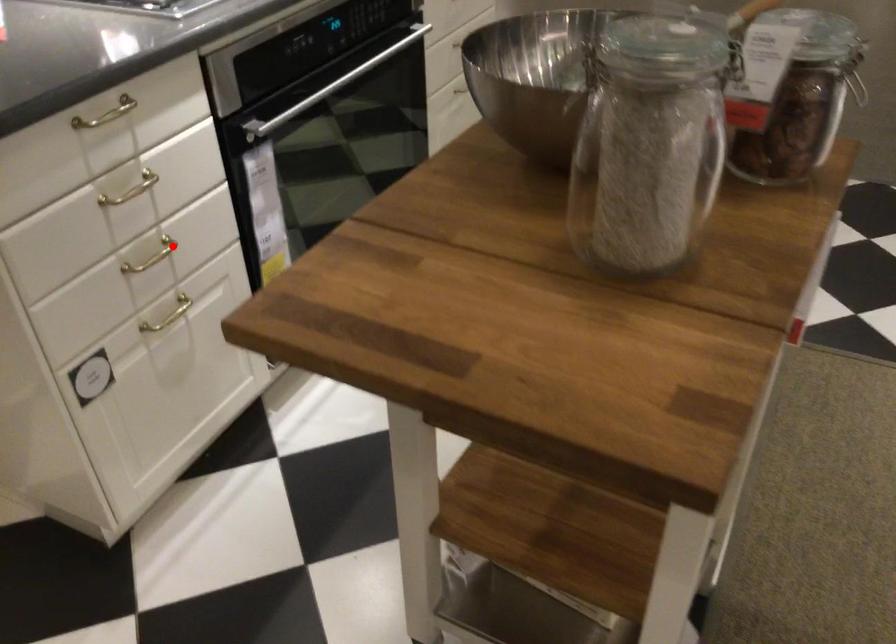
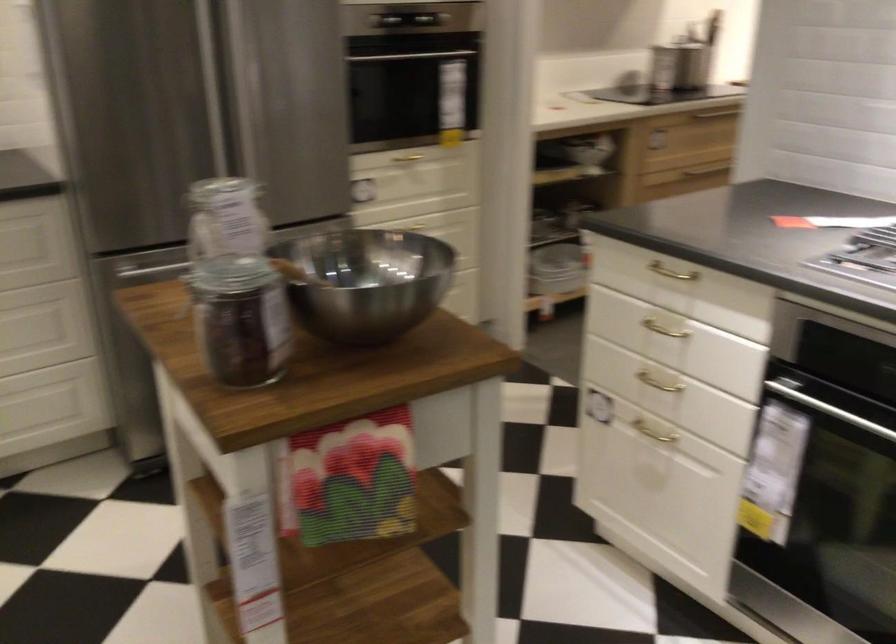
Question: I am providing you with two images of the same scene from different viewpoints. In image1, a red point is highlighted. Considering the same 3D point in image2, which of the following is correct?

Choices:
 (A) It is closer
 (B) It is farther

Answer: (B)